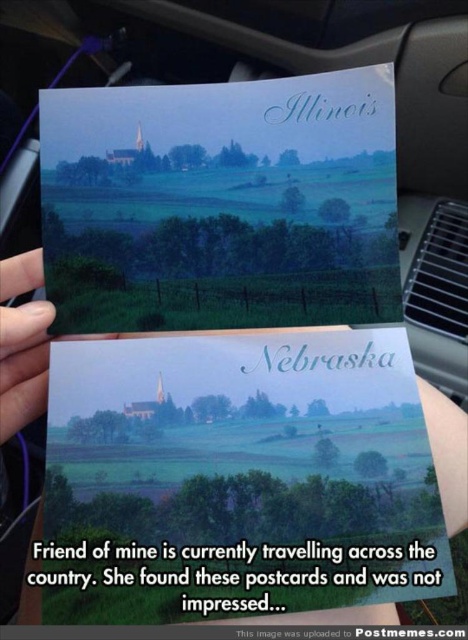
Who is higher up, matte paper postcard at center or white paper at center?

white paper at center is higher up.

Is matte paper postcard at center shorter than white paper at center?

No.

Identify the location of matte paper postcard at center. The width and height of the screenshot is (468, 640). (238, 477).

Does matte paper postcard at upper center have a smaller size compared to matte black finger at lower left?

No, matte paper postcard at upper center is not smaller than matte black finger at lower left.

Is point (81, 280) positioned behind point (38, 278)?

No, (81, 280) is in front of (38, 278).

Where is `matte paper postcard at upper center`? The height and width of the screenshot is (640, 468). matte paper postcard at upper center is located at coordinates (220, 204).

Looking at this image, measure the distance from matte paper postcard at center to matte black finger at lower left.

matte paper postcard at center and matte black finger at lower left are 7.47 inches apart from each other.

Locate an element on the screen. matte paper postcard at center is located at coordinates (238, 477).